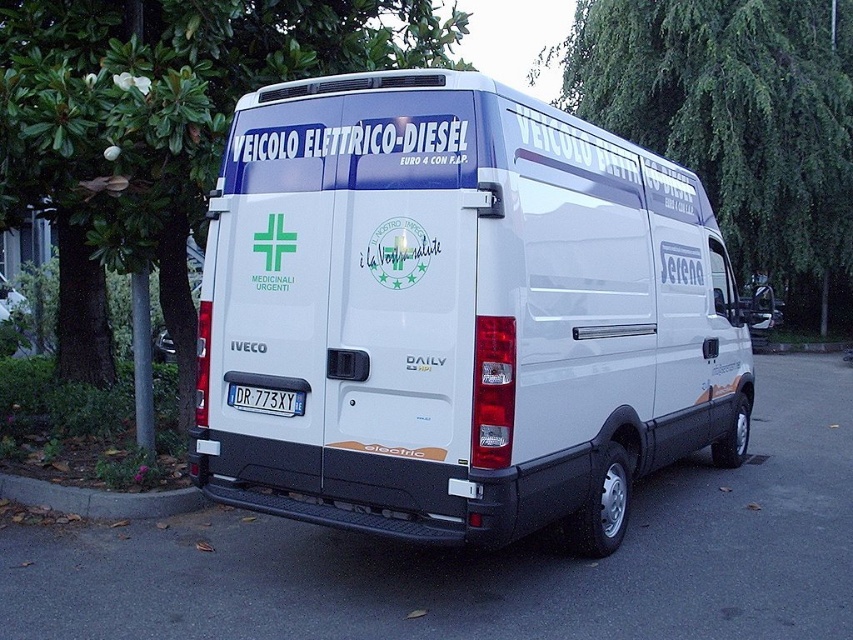
You are a delivery driver who needs to park your vehicle in a tight space. The space available is 3 meters long. You see the white glossy van at center and the concrete at lower left in the image. Can your vehicle fit into the space between them?

The distance between the white glossy van at center and the concrete at lower left is 3.12 meters. Since the available space is 3 meters, the vehicle can fit into the space between them with a small amount of room to spare.

You are a delivery driver who needs to park a vehicle on a flat surface. You see the white glossy van at center and concrete at lower left in the scene. Which surface is suitable for parking the vehicle?

The concrete at lower left is suitable for parking the vehicle since the white glossy van at center is positioned over it, indicating that the concrete can support the vehicle.

You are a delivery driver who needs to park your van so that the black plastic license plate at rear is visible to the traffic camera. The concrete at lower left is an obstacle. Which side of the road should you park on to ensure the license plate is visible while avoiding the concrete?

The concrete at lower left is positioned on the left side of black plastic license plate at rear. To avoid the concrete at lower left and keep the black plastic license plate at rear visible, you should park on the right side of the road so that the license plate remains unobstructed on the rear while the concrete is on the left side away from the camera view.